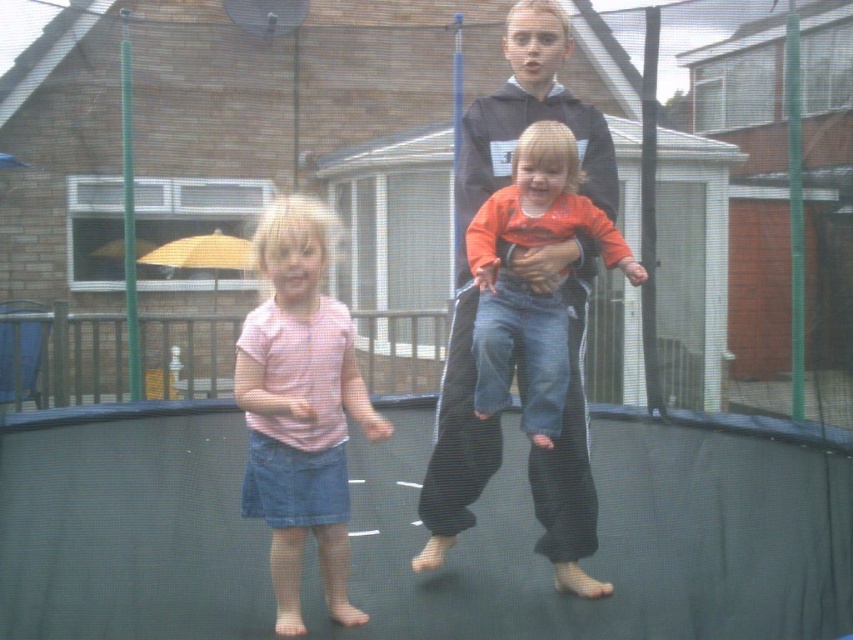
You are a parent supervising the children on the trampoline. You notice two shirts on the trampoline surface. Which one is larger between the black hoodie at center and the orange cotton shirt at center?

The black hoodie at center is bigger than the orange cotton shirt at center.

You are a safety inspector checking the trampoline for proper spacing between children. The safety guidelines require at least 24 inches between any two children to prevent collisions. Based on the image, is the distance between the pink cotton shirt at center and orange cotton shirt at center compliant with the safety guidelines?

The distance between the pink cotton shirt at center and orange cotton shirt at center is 25.04 inches, which exceeds the minimum requirement of 24 inches. Therefore, the spacing between them is compliant with the safety guidelines.

You are standing at the point marked as point (474, 150) and want to throw a ball to reach the children playing on the trampoline. The trampoline is 10.85 feet away from you. Is the distance sufficient to throw the ball to the children?

The distance between you and the children is 10.85 feet, so if your throwing range can cover that distance, you can successfully throw the ball to the children playing on the trampoline.